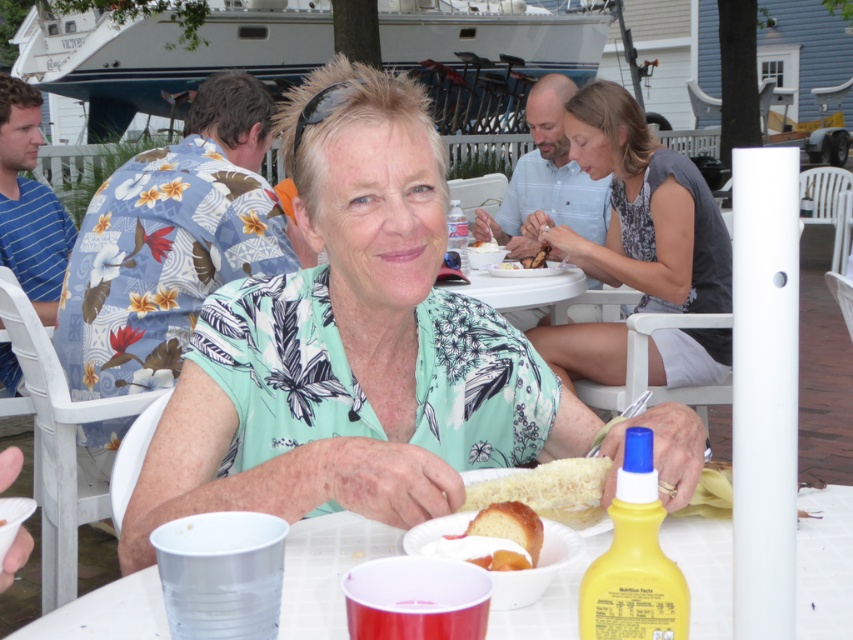
Question: Estimate the real-world distances between objects in this image. Which object is closer to the gray fabric dress at upper right?

Choices:
 (A) white crumbly bread at center
 (B) slightly toasted bread at center
 (C) white plastic table at center

Answer: (B)

Question: Can you confirm if white crumbly bread at center is positioned below yellow cake at center?

Choices:
 (A) no
 (B) yes

Answer: (A)

Question: From the image, what is the correct spatial relationship of white plastic table at center in relation to white fluffy bread at center?

Choices:
 (A) above
 (B) below

Answer: (B)

Question: Observing the image, what is the correct spatial positioning of white crumbly bread at center in reference to white fluffy bread at center?

Choices:
 (A) left
 (B) right

Answer: (A)

Question: Which object appears closest to the camera in this image?

Choices:
 (A) white fluffy bread at center
 (B) green floral shirt at center

Answer: (B)

Question: Which object is the closest to the white fluffy ice cream at center?

Choices:
 (A) green floral shirt at center
 (B) white fluffy bread at center
 (C) white plastic table at center
 (D) slightly toasted bread at center

Answer: (D)